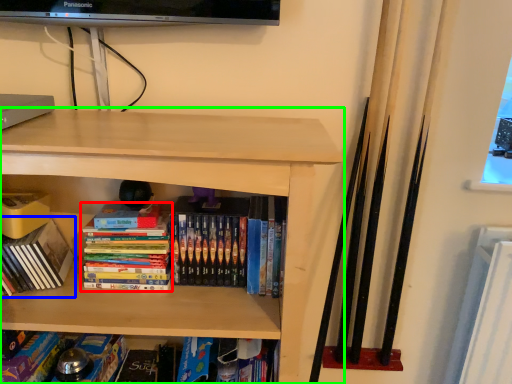
Question: Based on their relative distances, which object is farther from book (highlighted by a red box)? Choose from book (highlighted by a blue box) and shelf (highlighted by a green box).

Choices:
 (A) book
 (B) shelf

Answer: (B)